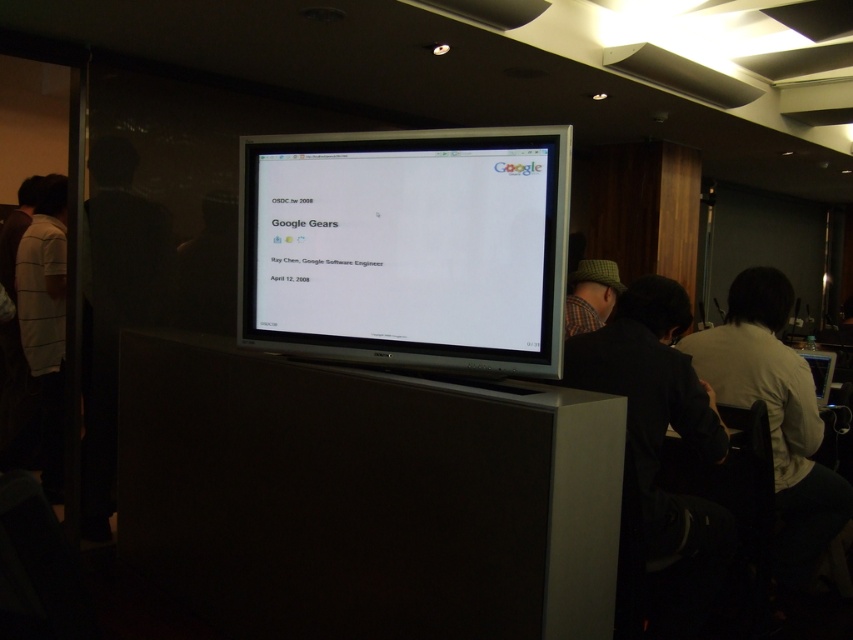
You are a photographer in the audience at the OSDC.tw 2008 event. You want to take a photo of the green plaid hat at center and the matte black monitor at center. Which object will appear larger in your photo?

The matte black monitor at center will appear larger in the photo because it is closer to the viewer than the green plaid hat at center.

You are an attendee at the OSDC.tw 2008 event. You notice the matte black monitor at center and the green plaid hat at center. Which object is positioned to the right side of the other?

The green plaid hat at center is positioned to the right of the matte black monitor at center.